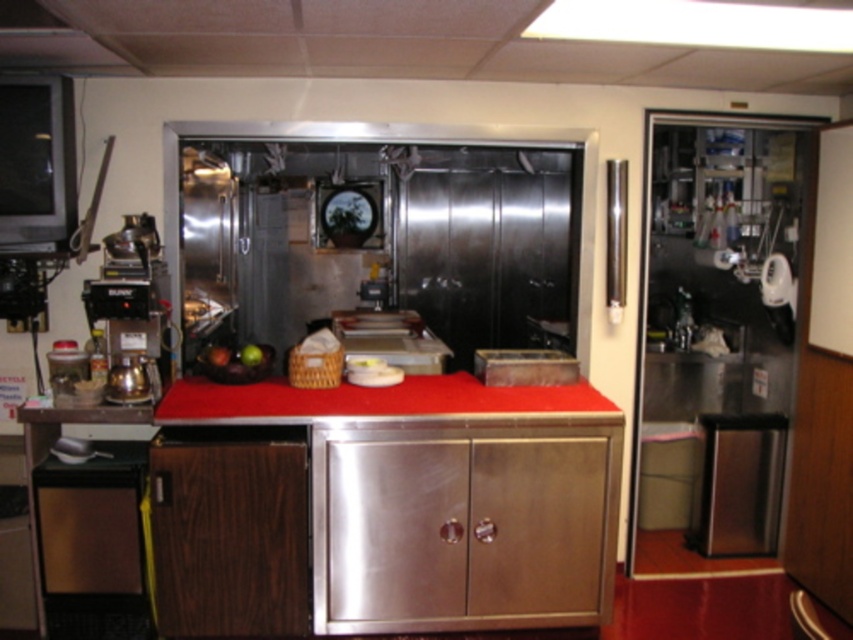
Is red matte counter top at center thinner than satin silver trash can at lower right?

No.

Is point (306, 404) positioned before point (766, 428)?

Yes, point (306, 404) is closer to viewer.

Is point (239, 410) less distant than point (727, 550)?

Yes.

Find the location of a particular element. This screenshot has width=853, height=640. red matte counter top at center is located at coordinates (373, 397).

Looking at this image, how distant is satin nickel dishwasher at lower left from red matte counter top at center?

satin nickel dishwasher at lower left is 69.04 centimeters from red matte counter top at center.

I want to click on satin nickel dishwasher at lower left, so click(x=93, y=545).

Who is taller, stainless steel cabinet at center or satin nickel dishwasher at lower left?

stainless steel cabinet at center is taller.

Does stainless steel cabinet at center appear on the left side of satin nickel dishwasher at lower left?

Incorrect, stainless steel cabinet at center is not on the left side of satin nickel dishwasher at lower left.

The image size is (853, 640). Describe the element at coordinates (463, 532) in the screenshot. I see `stainless steel cabinet at center` at that location.

Identify the location of stainless steel cabinet at center. (463, 532).